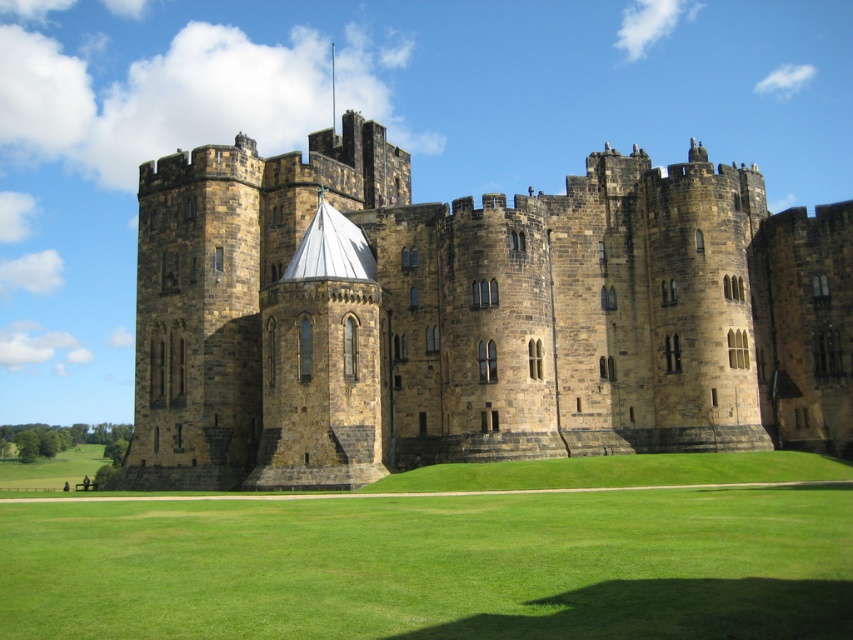
You are standing in front of the castle and notice two points marked on the lawn. The first point is at coordinates point (653, 390) and the second is at point (59, 566). If you want to walk from the castle towards the camera, which point will you step on first?

Point (59, 566) will be stepped on first because it is closer to the camera than point (653, 390), which is further away from the camera.

You are a photographer standing on the green grass at center, wanting to take a picture of the brown stone castle at center. Since the camera tripod is already casting a shadow there, where should you move to avoid blocking the view of the castle?

The green grass at center is behind the brown stone castle at center, so you should move to a position in front of the brown stone castle at center to avoid blocking the view and ensure the castle is fully visible in your photo.